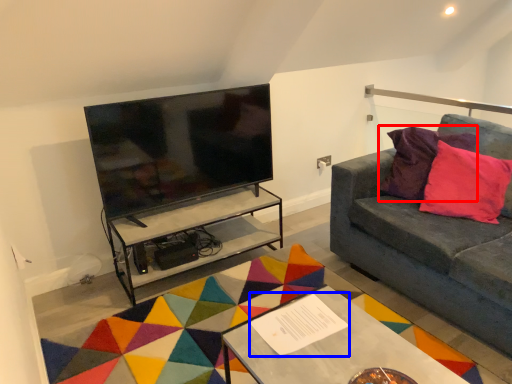
Question: Which of the following is the farthest to the observer, pillow (highlighted by a red box) or square (highlighted by a blue box)?

Choices:
 (A) pillow
 (B) square

Answer: (A)